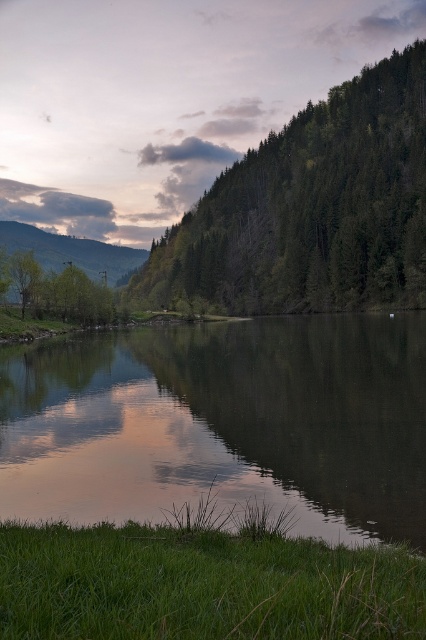
Is green textured forest at upper center shorter than green matte tree at left?

In fact, green textured forest at upper center may be taller than green matte tree at left.

Which is above, green textured forest at upper center or green matte tree at left?

green textured forest at upper center is higher up.

The width and height of the screenshot is (426, 640). What are the coordinates of `green textured forest at upper center` in the screenshot? It's located at (310, 209).

Which of these two, green textured forest at upper center or green matte mountain at left, stands taller?

green textured forest at upper center is taller.

Can you confirm if green textured forest at upper center is shorter than green matte mountain at left?

In fact, green textured forest at upper center may be taller than green matte mountain at left.

Describe the element at coordinates (310, 209) in the screenshot. I see `green textured forest at upper center` at that location.

This screenshot has height=640, width=426. Identify the location of green textured forest at upper center. (310, 209).

Which is behind, point (6, 417) or point (25, 268)?

The point (25, 268) is behind.

Looking at this image, is smooth reflective water at center above green matte tree at left?

Actually, smooth reflective water at center is below green matte tree at left.

Which is behind, point (72, 358) or point (97, 317)?

Point (97, 317)

Find the location of a particular element. The height and width of the screenshot is (640, 426). smooth reflective water at center is located at coordinates (224, 422).